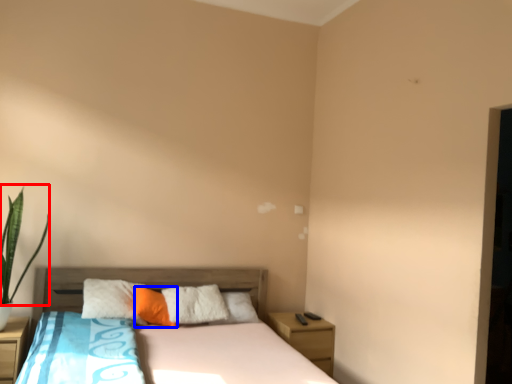
Question: Among these objects, which one is farthest to the camera, plant (highlighted by a red box) or pillow (highlighted by a blue box)?

Choices:
 (A) plant
 (B) pillow

Answer: (B)